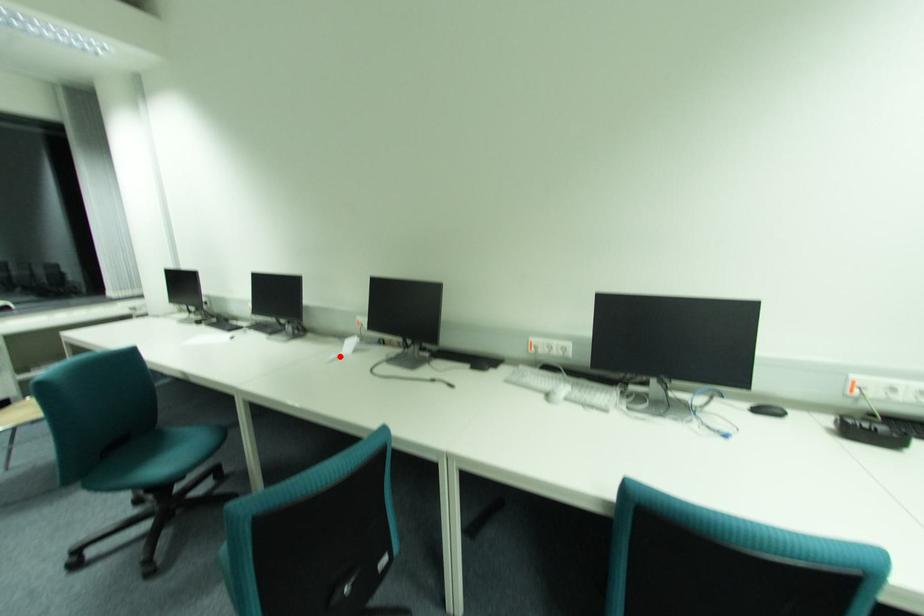
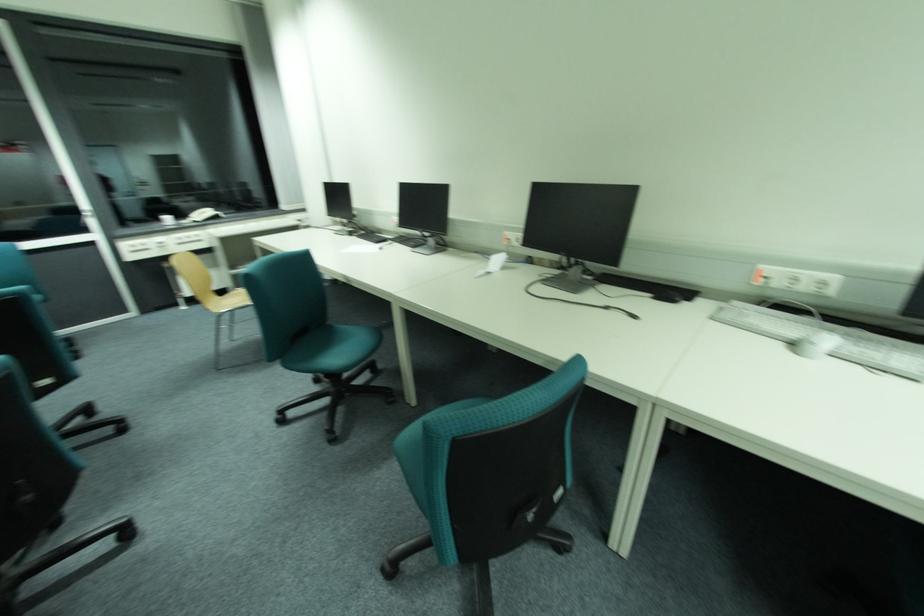
In the second image, find the point that corresponds to the highlighted location in the first image.

(487, 272)